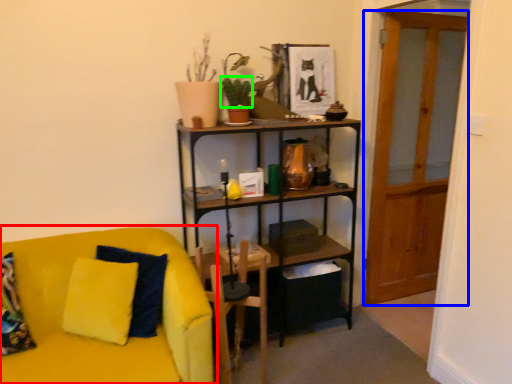
Question: Estimate the real-world distances between objects in this image. Which object is farther from studio couch (highlighted by a red box), glass door (highlighted by a blue box) or plant (highlighted by a green box)?

Choices:
 (A) glass door
 (B) plant

Answer: (A)